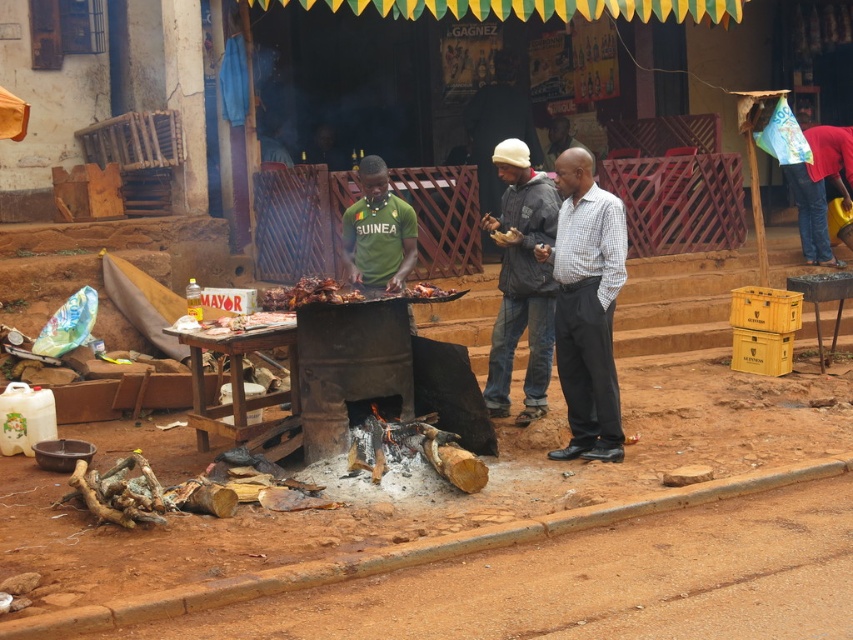
Looking at this image, you are standing at the camera position and want to pick up the gray woolen jacket at center. Is it within your reach without moving your feet?

The gray woolen jacket at center is 7.65 meters away from the camera, so it is too far to reach without moving your feet. You need to step forward to get it.

You are a photographer standing in front of the barbecue setup. You want to take a photo of the brown crispy meat at center while ensuring the gray woolen jacket at center is also visible in the frame. Is the jacket positioned in a way that it won let the meat be seen clearly?

The gray woolen jacket at center is further to the viewer than brown crispy meat at center, so the jacket is closer to you and might block the view of the meat. Adjust your position to ensure both are visible without obstruction.